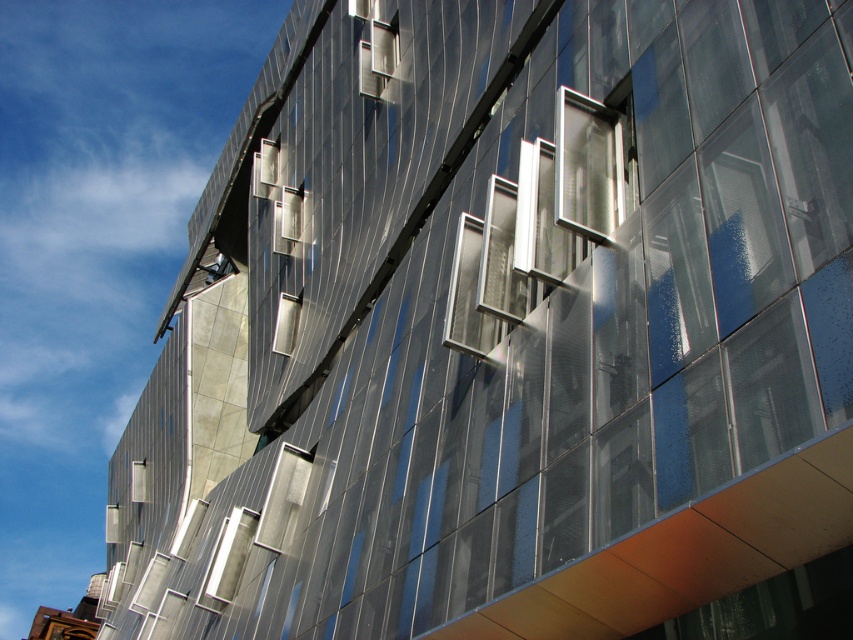
Question: Which of the following is the closest to the observer?

Choices:
 (A) (206, 589)
 (B) (489, 330)
 (C) (397, 60)

Answer: (B)

Question: Where is clear glass window at center located in relation to metallic silver window at upper center in the image?

Choices:
 (A) above
 (B) below

Answer: (B)

Question: Is metallic silver window at center positioned before metallic silver window at upper center?

Choices:
 (A) no
 (B) yes

Answer: (B)

Question: Which point is closer to the camera?

Choices:
 (A) metallic silver window at center
 (B) clear glass window at center

Answer: (B)

Question: Based on their relative distances, which object is farther from the metallic silver window at upper center?

Choices:
 (A) metallic silver window at center
 (B) clear glass window at center

Answer: (B)

Question: Does metallic silver window at center appear over metallic silver window at upper center?

Choices:
 (A) no
 (B) yes

Answer: (A)